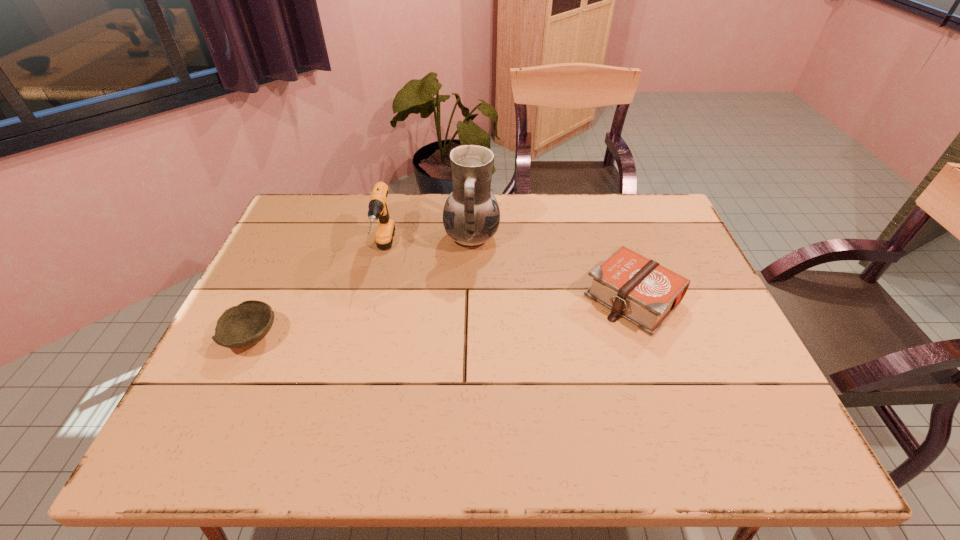
Find the location of a particular element. The width and height of the screenshot is (960, 540). vacant region located 0.050m on the left of the rightmost object is located at coordinates point(565,299).

Image resolution: width=960 pixels, height=540 pixels. Find the location of `free space located on the right of the bowl`. free space located on the right of the bowl is located at coordinates (416, 338).

You are a GUI agent. You are given a task and a screenshot of the screen. Output one action in this format:
    pyautogui.click(x=<x>, y=<y>)
    Task: Click on the pitcher that is at the far edge
    
    Given the screenshot: What is the action you would take?
    pyautogui.click(x=471, y=215)

Where is `drill positioned at the far edge`? This screenshot has height=540, width=960. drill positioned at the far edge is located at coordinates (378, 209).

Locate an element on the screen. object positioned at the left edge is located at coordinates (241, 326).

Where is `object located in the right edge section of the desktop`? This screenshot has height=540, width=960. object located in the right edge section of the desktop is located at coordinates pos(640,290).

Identify the location of free space at the far edge. (402, 193).

The width and height of the screenshot is (960, 540). In order to click on vacant space at the near edge of the desktop in this screenshot , I will do `click(557, 433)`.

Where is `free space at the left edge`? This screenshot has height=540, width=960. free space at the left edge is located at coordinates (208, 381).

Where is `vacant space at the right edge of the desktop`? vacant space at the right edge of the desktop is located at coordinates (693, 395).